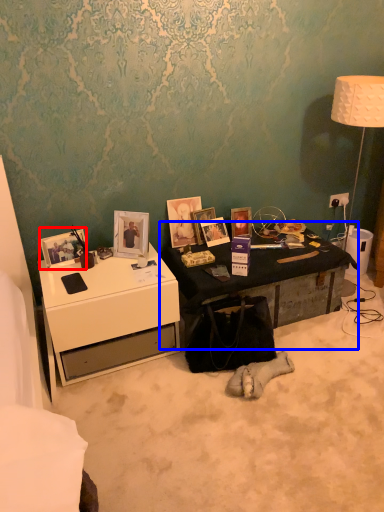
Question: Which object appears closest to the camera in this image, picture frame (highlighted by a red box) or table (highlighted by a blue box)?

Choices:
 (A) picture frame
 (B) table

Answer: (A)